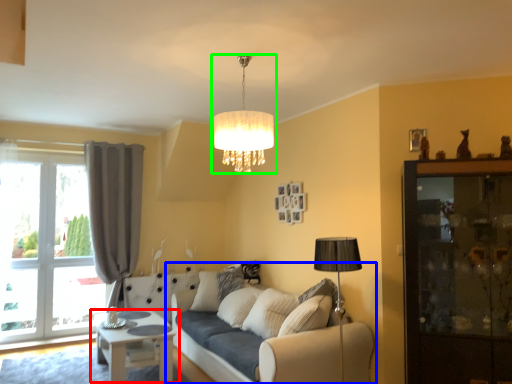
Question: Estimate the real-world distances between objects in this image. Which object is farther from table (highlighted by a red box), studio couch (highlighted by a blue box) or lamp (highlighted by a green box)?

Choices:
 (A) studio couch
 (B) lamp

Answer: (B)